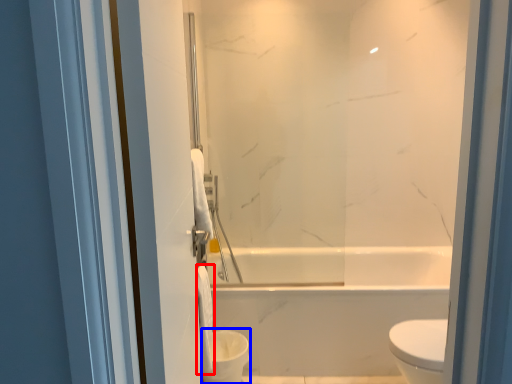
Question: Which object is further to the camera taking this photo, toilet paper (highlighted by a red box) or toilet bowl (highlighted by a blue box)?

Choices:
 (A) toilet paper
 (B) toilet bowl

Answer: (B)